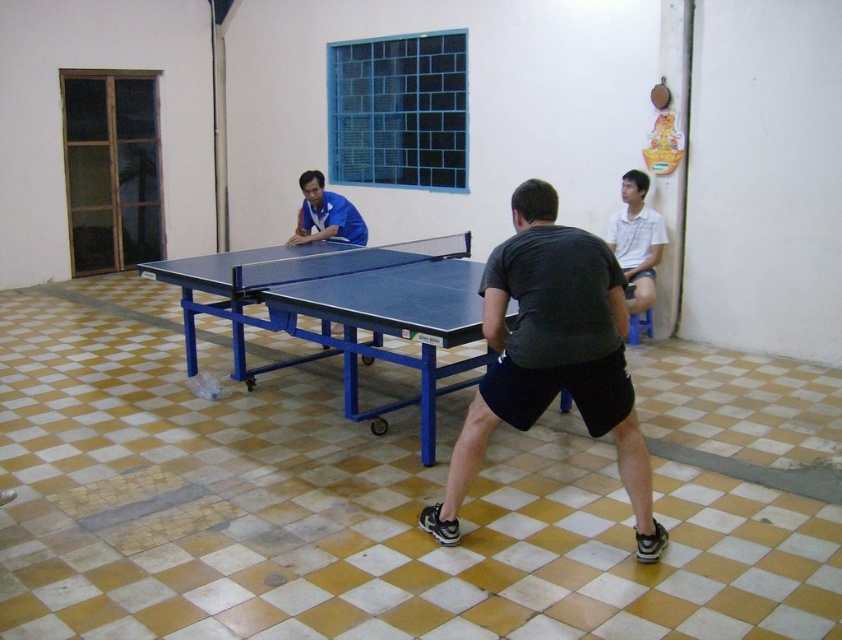
You are standing in the room and want to place a small sticker on the table tennis table. You have two points to choose from. The first point is at coordinates point [539,401] and the second point is at point [352,230]. Which point is closer to you where you can place the sticker more easily?

Point [539,401] is closer to the viewer than point [352,230], so you can place the sticker more easily there.

You are a photographer positioned at the back of the room. You want to take a photo of both the dark gray fabric shirt at center and the white cotton shirt at upper right without any obstructions. Based on their positions, which direction should you move to ensure both are visible in the frame?

Since the dark gray fabric shirt at center is to the left of the white cotton shirt at upper right, you should move to the right side of the room to ensure both are visible in the frame without obstruction.

You are a player in the table tennis game. You are standing at the point labeled as point [621,262]. Your opponent is at point [610,332]. The ball is coming towards you from the opponent. Where should you move to hit the ball effectively?

You should move to the point in front of your current position, which is point [610,332], to hit the ball effectively since it is positioned in front of your current location.